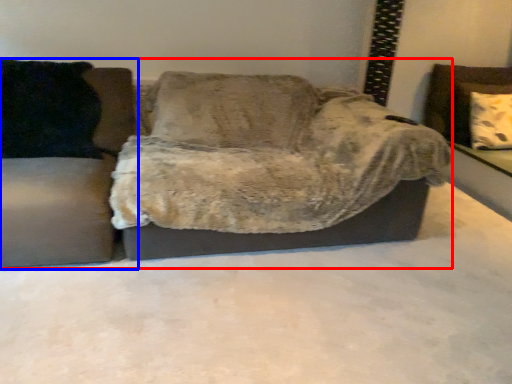
Question: Which object appears farthest to the camera in this image, studio couch (highlighted by a red box) or studio couch (highlighted by a blue box)?

Choices:
 (A) studio couch
 (B) studio couch

Answer: (A)